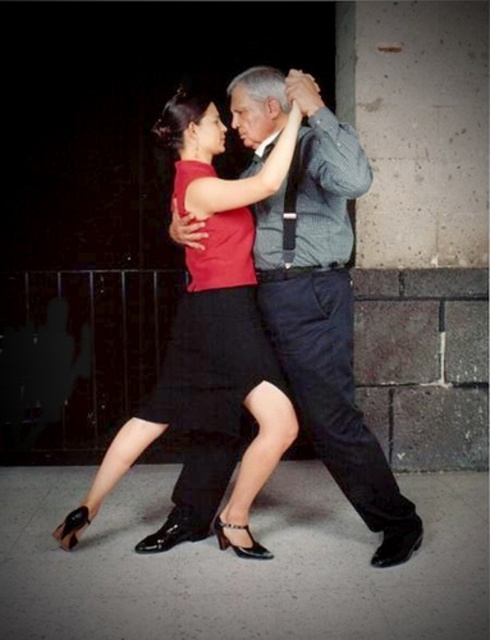
You are a photographer at a fashion show. You notice two red garments in the center of the image. The first is a matte red blouse at center, and the second is a matte red dress at center. Which garment is positioned to the left?

The matte red blouse at center is positioned to the left of the matte red dress at center.

You are standing in the middle of the dance floor and see two points marked in the image. Which point, point (236, 124) or point (245, 360), is closer to you?

Point (236, 124) is further to the viewer than point (245, 360), so the closer point to you is point (245, 360).

You are a photographer standing in front of the dancers. You notice the matte gray shirt at center and the matte red blouse at center. Which one is closer to you?

The matte gray shirt at center is closer to you because it is in front of the matte red blouse at center.